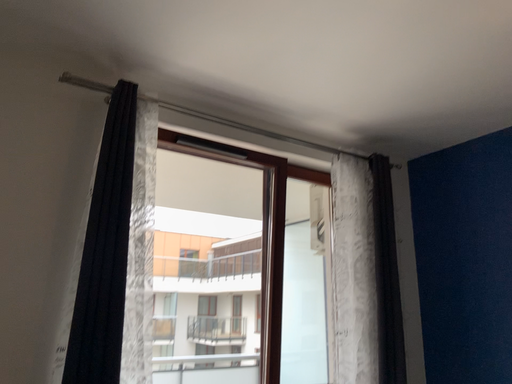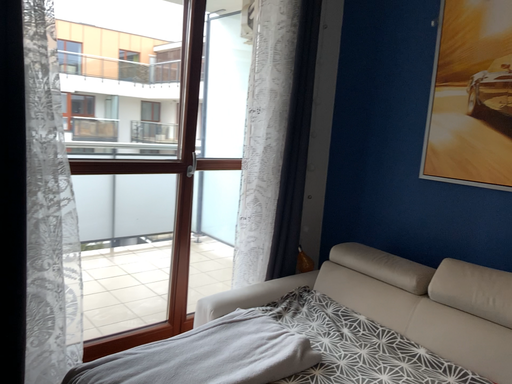
Question: Which way did the camera rotate in the video?

Choices:
 (A) rotated upward
 (B) rotated downward

Answer: (B)